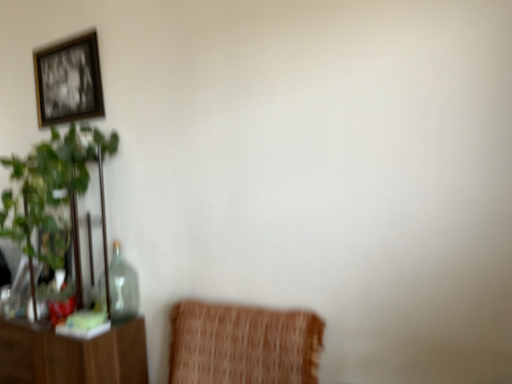
Question: From a real-world perspective, is gold-framed picture at upper left over green leafy plant at left?

Choices:
 (A) yes
 (B) no

Answer: (A)

Question: Does gold-framed picture at upper left lie in front of green leafy plant at left?

Choices:
 (A) no
 (B) yes

Answer: (A)

Question: From the image's perspective, is gold-framed picture at upper left over green leafy plant at left?

Choices:
 (A) yes
 (B) no

Answer: (A)

Question: Can you confirm if gold-framed picture at upper left is shorter than green leafy plant at left?

Choices:
 (A) yes
 (B) no

Answer: (A)

Question: Can you confirm if gold-framed picture at upper left is positioned to the right of green leafy plant at left?

Choices:
 (A) no
 (B) yes

Answer: (A)

Question: In the image, is green leafy plant at left on the left side or the right side of transparent glass bottle at left?

Choices:
 (A) left
 (B) right

Answer: (A)

Question: From a real-world perspective, is green leafy plant at left positioned above or below transparent glass bottle at left?

Choices:
 (A) above
 (B) below

Answer: (A)

Question: Is green leafy plant at left in front of or behind transparent glass bottle at left in the image?

Choices:
 (A) front
 (B) behind

Answer: (A)

Question: From the image's perspective, is green leafy plant at left above or below transparent glass bottle at left?

Choices:
 (A) above
 (B) below

Answer: (A)

Question: Considering the positions of transparent glass bottle at left and gold-framed picture at upper left in the image, is transparent glass bottle at left taller or shorter than gold-framed picture at upper left?

Choices:
 (A) tall
 (B) short

Answer: (B)

Question: In terms of size, does transparent glass bottle at left appear bigger or smaller than gold-framed picture at upper left?

Choices:
 (A) big
 (B) small

Answer: (A)

Question: Does point (100, 278) appear closer or farther from the camera than point (82, 64)?

Choices:
 (A) farther
 (B) closer

Answer: (A)

Question: From the image's perspective, is transparent glass bottle at left above or below gold-framed picture at upper left?

Choices:
 (A) below
 (B) above

Answer: (A)

Question: Is gold-framed picture at upper left bigger or smaller than transparent glass bottle at left?

Choices:
 (A) big
 (B) small

Answer: (B)

Question: Choose the correct answer: Is gold-framed picture at upper left inside transparent glass bottle at left or outside it?

Choices:
 (A) inside
 (B) outside

Answer: (B)